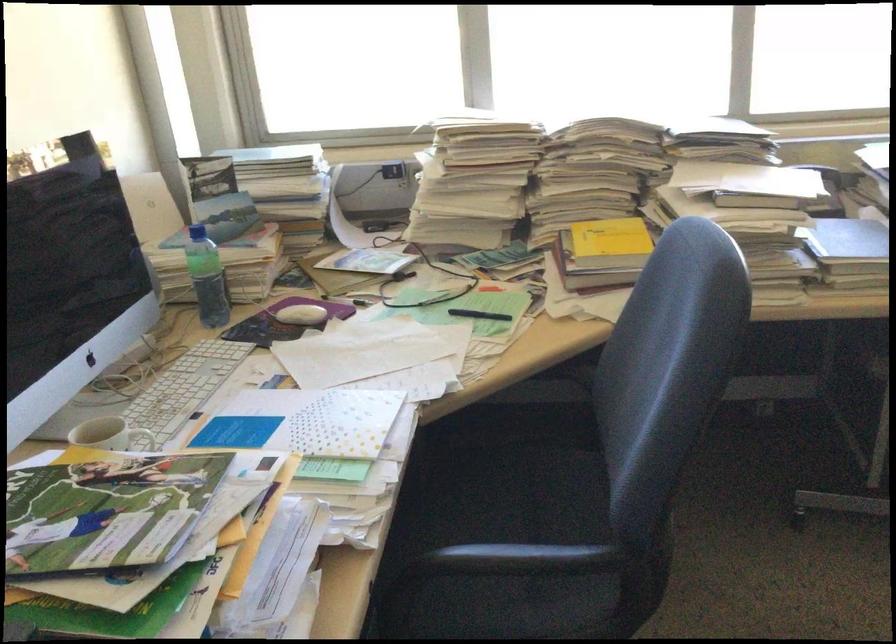
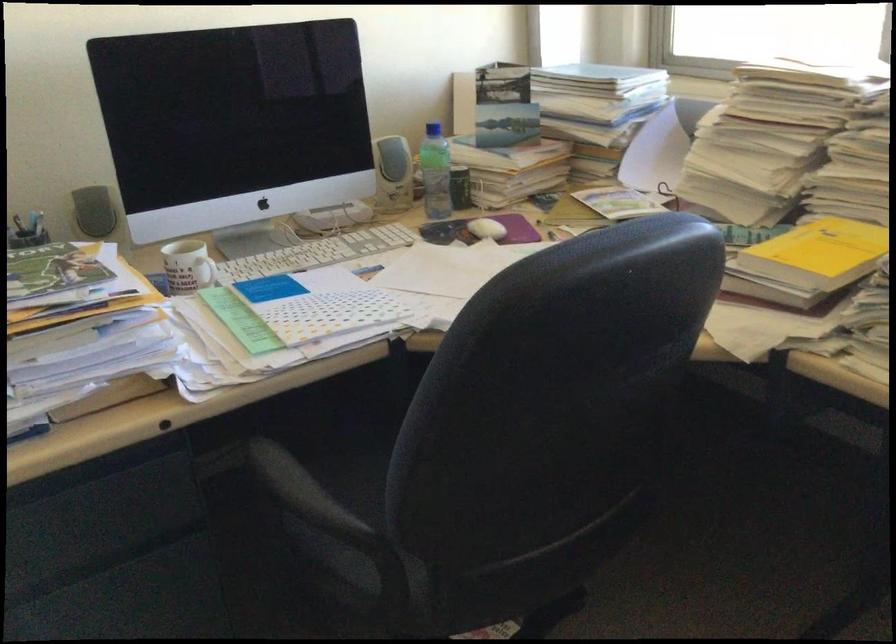
In the second image, find the point that corresponds to the point at 314,313 in the first image.

(487, 229)